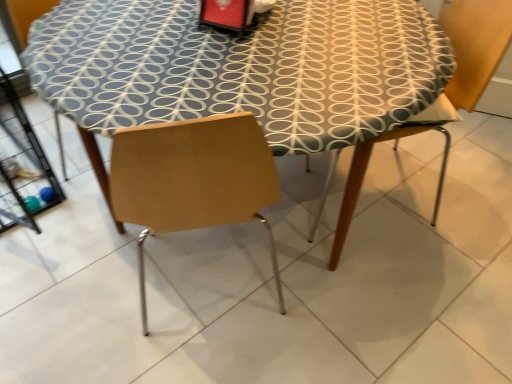
Question: From the image's perspective, is wooden chair at right located beneath patterned fabric table at center?

Choices:
 (A) yes
 (B) no

Answer: (B)

Question: Is wooden chair at right to the left of patterned fabric table at center from the viewer's perspective?

Choices:
 (A) yes
 (B) no

Answer: (B)

Question: Considering the relative positions of wooden chair at right and patterned fabric table at center in the image provided, is wooden chair at right in front of patterned fabric table at center?

Choices:
 (A) yes
 (B) no

Answer: (B)

Question: Is patterned fabric table at center inside wooden chair at right?

Choices:
 (A) no
 (B) yes

Answer: (A)

Question: Is wooden chair at right at the right side of patterned fabric table at center?

Choices:
 (A) no
 (B) yes

Answer: (B)

Question: Could you tell me if wooden chair at right is turned towards patterned fabric table at center?

Choices:
 (A) no
 (B) yes

Answer: (B)

Question: Is patterned fabric table at center positioned with its back to wooden chair at right?

Choices:
 (A) no
 (B) yes

Answer: (A)

Question: From a real-world perspective, is patterned fabric table at center below wooden chair at right?

Choices:
 (A) no
 (B) yes

Answer: (B)

Question: Can you confirm if patterned fabric table at center is wider than wooden chair at right?

Choices:
 (A) no
 (B) yes

Answer: (B)

Question: Can you confirm if patterned fabric table at center is taller than wooden chair at right?

Choices:
 (A) yes
 (B) no

Answer: (B)

Question: From the image's perspective, is patterned fabric table at center below wooden chair at right?

Choices:
 (A) yes
 (B) no

Answer: (A)

Question: Does patterned fabric table at center come in front of wooden chair at right?

Choices:
 (A) yes
 (B) no

Answer: (A)

Question: Choose the correct answer: Is wooden chair at right inside patterned fabric table at center or outside it?

Choices:
 (A) inside
 (B) outside

Answer: (A)